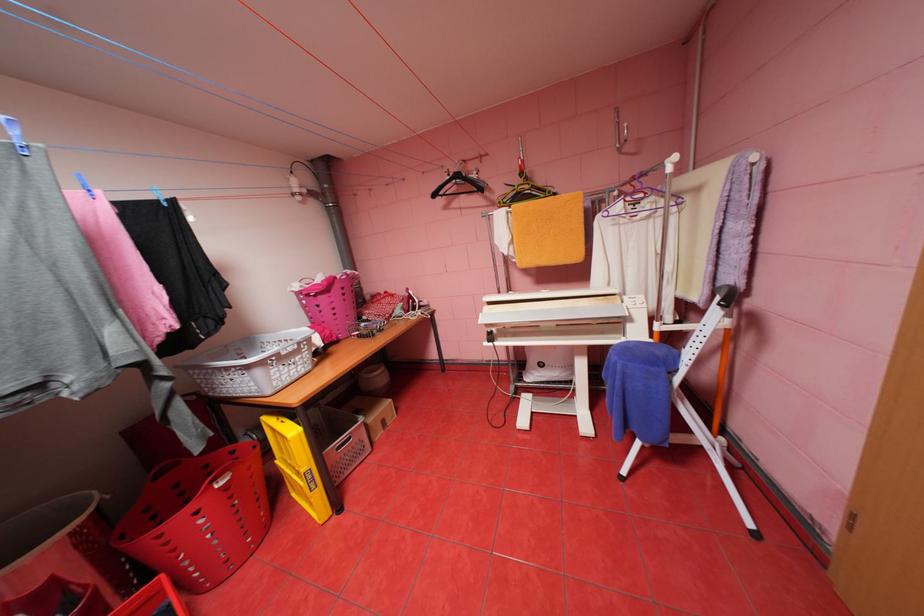
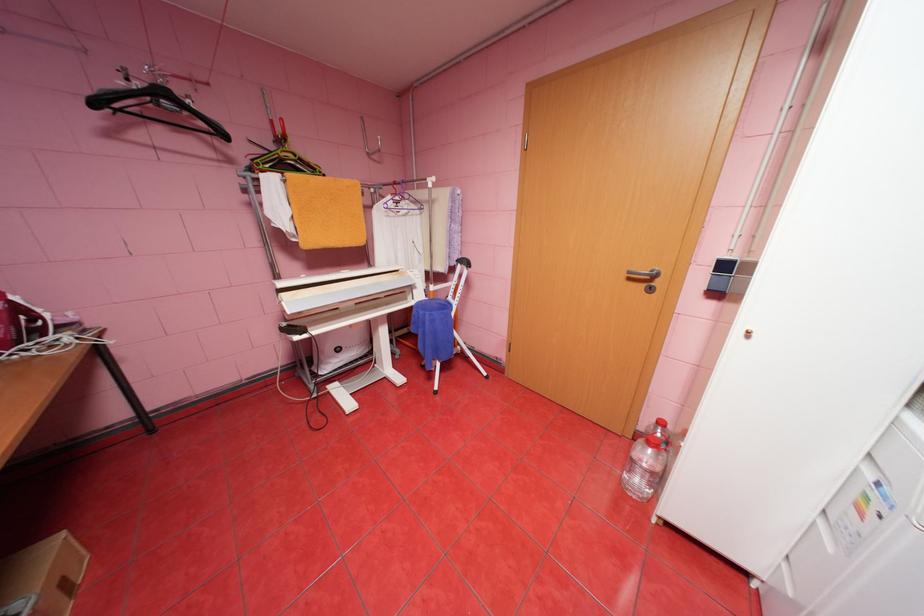
Locate, in the second image, the point that corresponds to point 443,195 in the first image.

(103, 103)